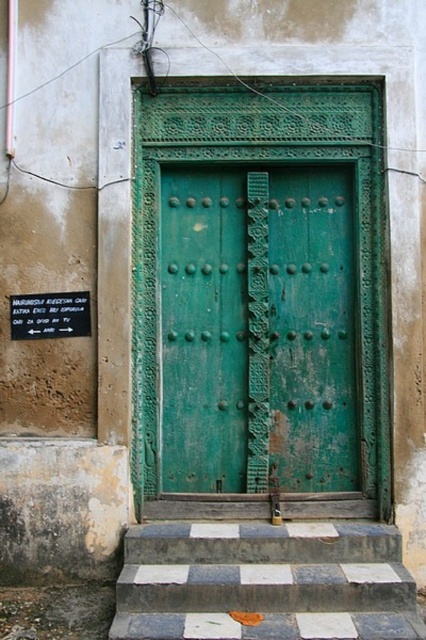
Question: Can you confirm if green wooden door at center is smaller than black plastic sign at lower left?

Choices:
 (A) yes
 (B) no

Answer: (B)

Question: Considering the real-world distances, which object is closest to the black plastic sign at lower left?

Choices:
 (A) checkerboard tile stairs at center
 (B) green wooden door at center

Answer: (B)

Question: Does green wooden door at center have a lesser width compared to checkerboard tile stairs at center?

Choices:
 (A) no
 (B) yes

Answer: (B)

Question: Which of the following is the closest to the observer?

Choices:
 (A) black plastic sign at lower left
 (B) green wooden door at center

Answer: (A)

Question: Which object is positioned closest to the green wooden door at center?

Choices:
 (A) checkerboard tile stairs at center
 (B) black plastic sign at lower left

Answer: (B)

Question: Is green wooden door at center wider than black plastic sign at lower left?

Choices:
 (A) yes
 (B) no

Answer: (A)